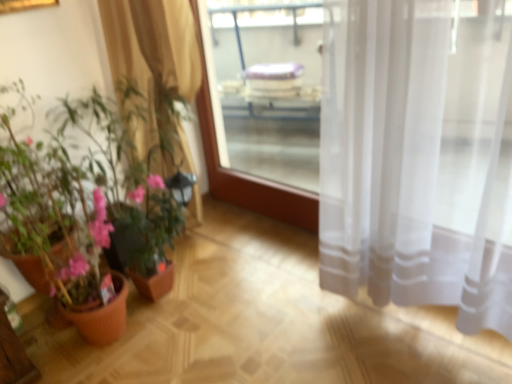
Question: From the image's perspective, relative to transparent glass window screen at center, is beige sheer curtain at left above or below?

Choices:
 (A) below
 (B) above

Answer: (A)

Question: Considering their positions, is beige sheer curtain at left located in front of or behind transparent glass window screen at center?

Choices:
 (A) behind
 (B) front

Answer: (B)

Question: Estimate the real-world distances between objects in this image. Which object is closer to the terracotta pot plant at left?

Choices:
 (A) beige sheer curtain at left
 (B) transparent glass window screen at center

Answer: (A)

Question: Which object is the closest to the terracotta pot plant at left?

Choices:
 (A) beige sheer curtain at left
 (B) transparent glass window screen at center

Answer: (A)